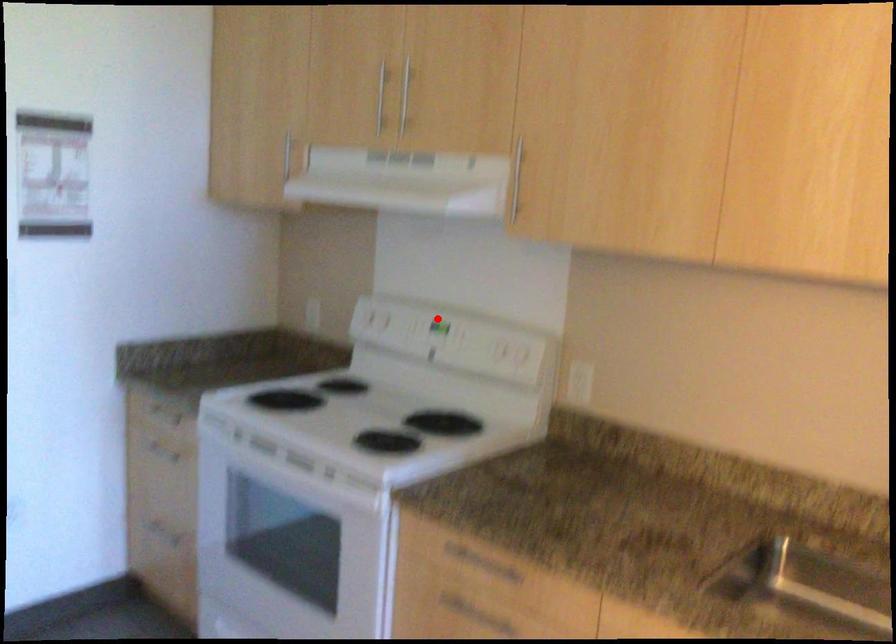
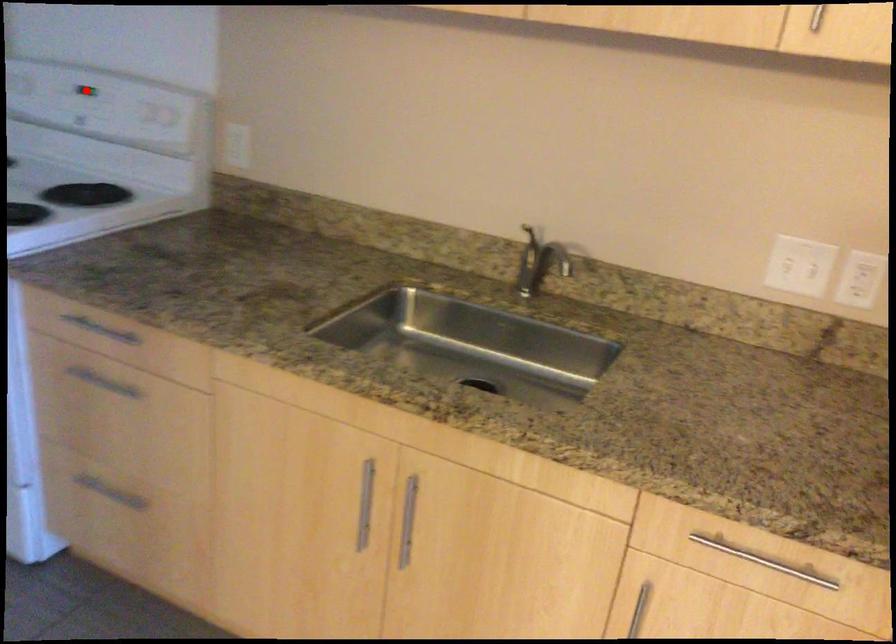
I am providing you with two images of the same scene from different viewpoints. A red point is marked on the first image and another point is marked on the second image. Does the point marked in image1 correspond to the same location as the one in image2?

Yes